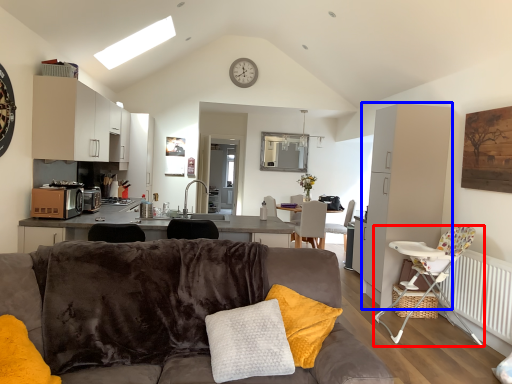
Question: Among these objects, which one is farthest to the camera, chair (highlighted by a red box) or cabinetry (highlighted by a blue box)?

Choices:
 (A) chair
 (B) cabinetry

Answer: (B)